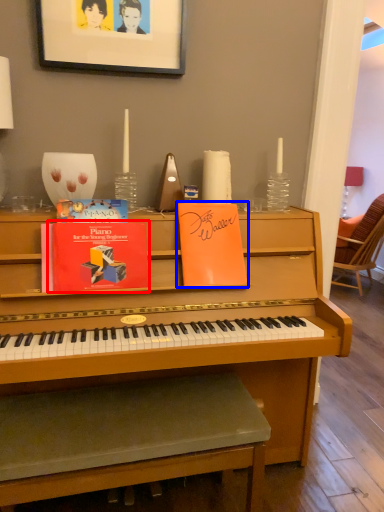
Question: Which object is further to the camera taking this photo, paperback book (highlighted by a red box) or paperback book (highlighted by a blue box)?

Choices:
 (A) paperback book
 (B) paperback book

Answer: (B)